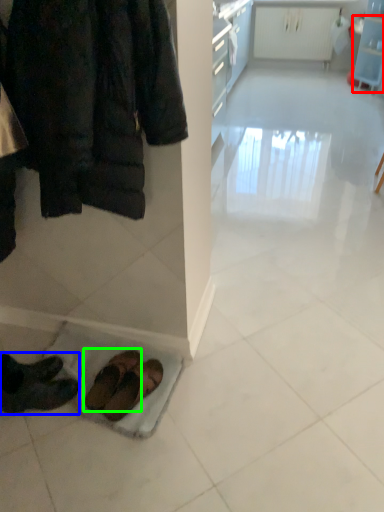
Question: Based on their relative distances, which object is nearer to shelf (highlighted by a red box)? Choose from footwear (highlighted by a blue box) and footwear (highlighted by a green box).

Choices:
 (A) footwear
 (B) footwear

Answer: (B)